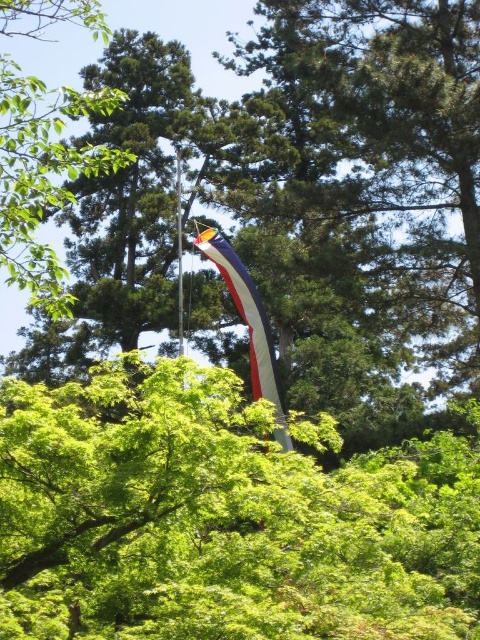
You are a bird flying over the scene. You see the green leafy tree at center and the white fabric flag at center. Which object is directly above the other?

The white fabric flag at center is directly above the green leafy tree at center because the green leafy tree at center is positioned under the white fabric flag at center.